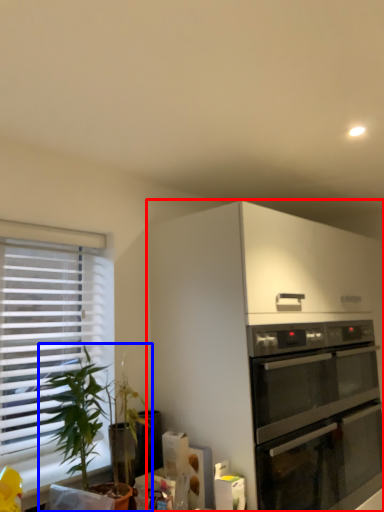
Question: Which object appears farthest to the camera in this image, cabinetry (highlighted by a red box) or houseplant (highlighted by a blue box)?

Choices:
 (A) cabinetry
 (B) houseplant

Answer: (A)